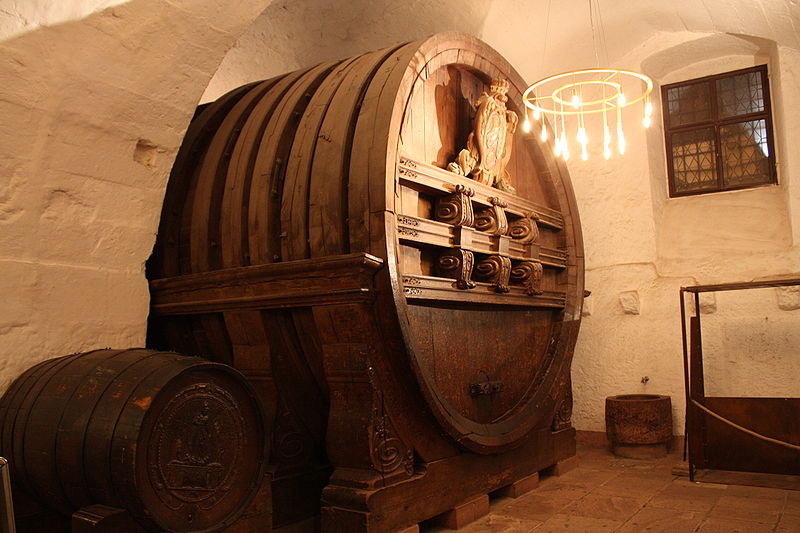
The width and height of the screenshot is (800, 533). Find the location of `window`. window is located at coordinates (720, 127).